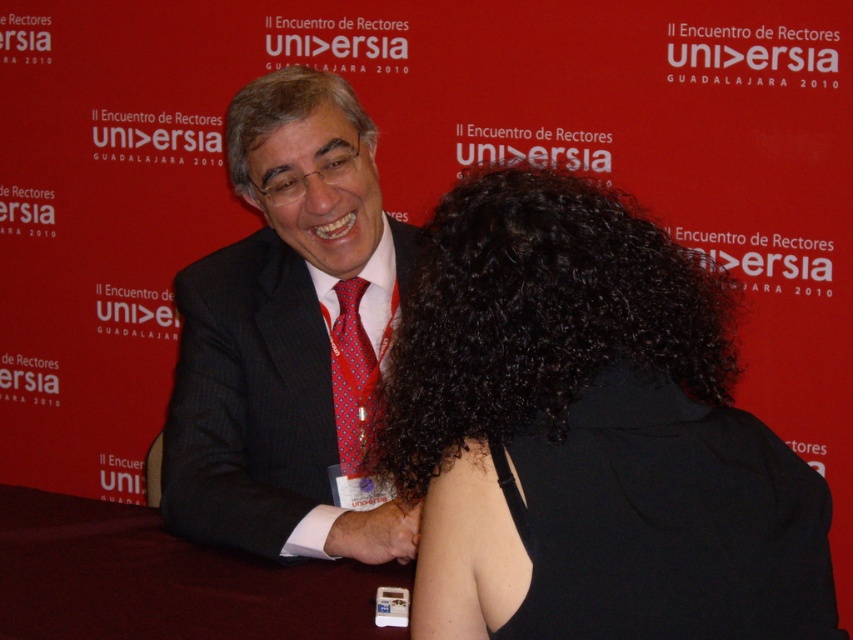
You are standing at the point labeled as point (x=403, y=538) and want to take a photo of the vibrant red banner with the event details. The camera you have can focus on objects within 1.5 meters. Can you capture a clear photo of the banner from your current position?

The distance between point (x=403, y=538) and the camera is 1.23 meters, which is within the camera focus range of 1.5 meters. Therefore, you can capture a clear photo of the banner from your current position.

What is located at the coordinates point (285, 113)?

The point (285, 113) is located on gray curly hair at center.